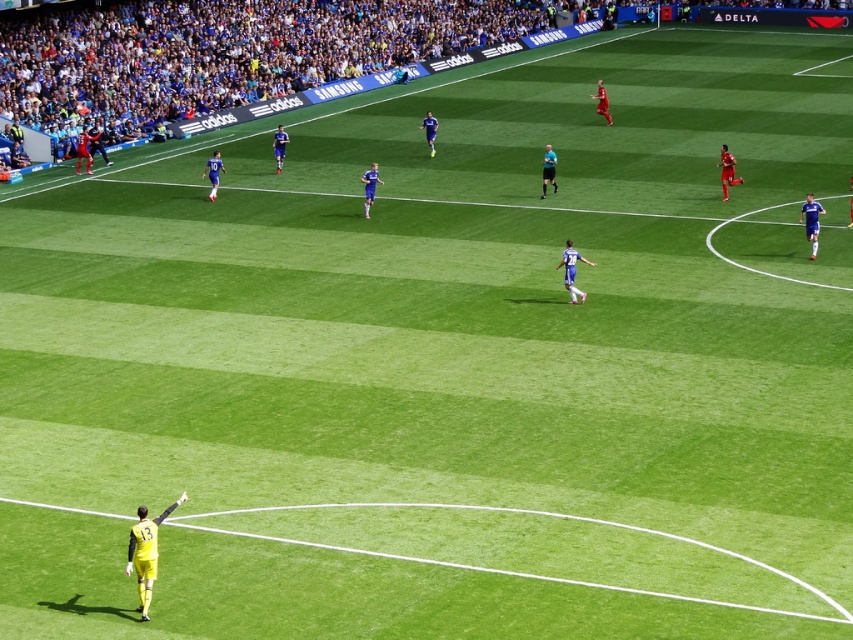
You are a photographer at the soccer match. You want to capture a photo that includes both the blue jersey at right and the black uniform at center. Which player should you focus on first to ensure both are in the frame?

The blue jersey at right is larger in size compared to the black uniform at center, so you should focus on the blue jersey at right first to ensure it fits within the frame.

You are a referee observing a soccer match. You see a black uniform at center and a blue smooth soccer player at center. Which player is positioned to the right of the other?

The black uniform at center is positioned on the right side of blue smooth soccer player at center.